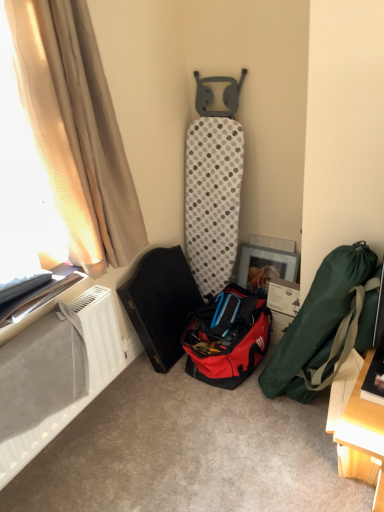
What do you see at coordinates (227, 341) in the screenshot? I see `red fabric bag at center, which is the second luggage and bags in right-to-left order` at bounding box center [227, 341].

Find the location of a particular element. green fabric bag at right, which is the 2th luggage and bags from left to right is located at coordinates (318, 321).

What do you see at coordinates (21, 188) in the screenshot? I see `translucent beige curtain at left` at bounding box center [21, 188].

Find the location of a particular element. This screenshot has height=512, width=384. red fabric bag at center, which is the second luggage and bags in right-to-left order is located at coordinates (227, 341).

Looking at this image, from the image's perspective, is white plastic radiator at lower left on green fabric bag at right, the 1th luggage and bags when ordered from right to left?

No, from the image's perspective, white plastic radiator at lower left is not on top of green fabric bag at right, the 1th luggage and bags when ordered from right to left.

Consider the image. Can you confirm if white plastic radiator at lower left is smaller than green fabric bag at right, which is the 2th luggage and bags from left to right?

Yes, white plastic radiator at lower left is smaller than green fabric bag at right, which is the 2th luggage and bags from left to right.

From a real-world perspective, which object rests below the other?

From a 3D spatial view, green fabric bag at right, the 1th luggage and bags when ordered from right to left, is below.

Is white plastic radiator at lower left surrounding green fabric bag at right, which is the 2th luggage and bags from left to right?

No, green fabric bag at right, which is the 2th luggage and bags from left to right, is located outside of white plastic radiator at lower left.

From a real-world perspective, is green fabric bag at right, which is the 2th luggage and bags from left to right, on top of translucent beige curtain at left?

No, from a real-world perspective, green fabric bag at right, which is the 2th luggage and bags from left to right, is not on top of translucent beige curtain at left.

In terms of height, does green fabric bag at right, the 1th luggage and bags when ordered from right to left, look taller or shorter compared to translucent beige curtain at left?

In the image, green fabric bag at right, the 1th luggage and bags when ordered from right to left, appears to be shorter than translucent beige curtain at left.

Can you see green fabric bag at right, which is the 2th luggage and bags from left to right, touching translucent beige curtain at left?

No, green fabric bag at right, which is the 2th luggage and bags from left to right, is not next to translucent beige curtain at left.

Who is more distant, beige fabric curtain at left or white plastic radiator at lower left?

white plastic radiator at lower left is further from the camera.

From the image's perspective, which one is positioned lower, beige fabric curtain at left or white plastic radiator at lower left?

white plastic radiator at lower left, from the image's perspective.

Based on the photo, how many degrees apart are the facing directions of beige fabric curtain at left and white plastic radiator at lower left?

1.37 degrees.

Is beige fabric curtain at left at the right side of white plastic radiator at lower left?

Yes.

Which is more to the right, red fabric bag at center, which is the second luggage and bags in right-to-left order, or green fabric bag at right, which is the 2th luggage and bags from left to right?

From the viewer's perspective, green fabric bag at right, which is the 2th luggage and bags from left to right, appears more on the right side.

From a real-world perspective, is red fabric bag at center, which is the second luggage and bags in right-to-left order, physically above green fabric bag at right, which is the 2th luggage and bags from left to right?

No, from a real-world perspective, red fabric bag at center, which is the second luggage and bags in right-to-left order, is not above green fabric bag at right, which is the 2th luggage and bags from left to right.

Can you tell me how much red fabric bag at center, which is the second luggage and bags in right-to-left order, and green fabric bag at right, the 1th luggage and bags when ordered from right to left, differ in facing direction?

They differ by 0.0369 degrees in their facing directions.

What are the coordinates of `luggage and bags on the right of the red fabric bag at center, the 1th luggage and bags in the left-to-right sequence` in the screenshot? It's located at (318, 321).

From a real-world perspective, is translucent beige curtain at left on white plastic radiator at lower left?

Indeed, from a real-world perspective, translucent beige curtain at left stands above white plastic radiator at lower left.

Would you say translucent beige curtain at left is inside or outside white plastic radiator at lower left?

translucent beige curtain at left is spatially situated outside white plastic radiator at lower left.

Considering the relative positions of translucent beige curtain at left and white plastic radiator at lower left in the image provided, is translucent beige curtain at left to the left or to the right of white plastic radiator at lower left?

In the image, translucent beige curtain at left appears on the left side of white plastic radiator at lower left.

The height and width of the screenshot is (512, 384). I want to click on window screen above the white plastic radiator at lower left (from a real-world perspective), so click(21, 188).

Is point (5, 163) closer or farther from the camera than point (248, 325)?

Point (5, 163) is closer to the camera than point (248, 325).

Is the surface of translucent beige curtain at left in direct contact with red fabric bag at center, the 1th luggage and bags in the left-to-right sequence?

No, translucent beige curtain at left is not touching red fabric bag at center, the 1th luggage and bags in the left-to-right sequence.

From the image's perspective, is translucent beige curtain at left under red fabric bag at center, which is the second luggage and bags in right-to-left order?

Actually, translucent beige curtain at left appears above red fabric bag at center, which is the second luggage and bags in right-to-left order, in the image.

Is translucent beige curtain at left facing towards red fabric bag at center, the 1th luggage and bags in the left-to-right sequence?

No, translucent beige curtain at left does not turn towards red fabric bag at center, the 1th luggage and bags in the left-to-right sequence.

Is white plastic radiator at lower left oriented towards beige fabric curtain at left?

No, white plastic radiator at lower left is not aimed at beige fabric curtain at left.

Is white plastic radiator at lower left situated inside beige fabric curtain at left or outside?

white plastic radiator at lower left cannot be found inside beige fabric curtain at left.

From a real-world perspective, is white plastic radiator at lower left physically above beige fabric curtain at left?

Incorrect, from a real-world perspective, white plastic radiator at lower left is lower than beige fabric curtain at left.

Which of these two, white plastic radiator at lower left or beige fabric curtain at left, stands taller?

With more height is beige fabric curtain at left.

There is a white plastic radiator at lower left. Where is `the 1st luggage and bags below it (from a real-world perspective)`? This screenshot has width=384, height=512. the 1st luggage and bags below it (from a real-world perspective) is located at coordinates (318, 321).

Identify the location of window screen on the left of the green fabric bag at right, which is the 2th luggage and bags from left to right. (21, 188).

Estimate the real-world distances between objects in this image. Which object is closer to beige fabric curtain at left, white plastic radiator at lower left or translucent beige curtain at left?

translucent beige curtain at left is positioned closer to the anchor beige fabric curtain at left.

Based on their spatial positions, is translucent beige curtain at left or green fabric bag at right, the 1th luggage and bags when ordered from right to left, further from beige fabric curtain at left?

Based on the image, green fabric bag at right, the 1th luggage and bags when ordered from right to left, appears to be further to beige fabric curtain at left.

Looking at the image, which one is located closer to beige fabric curtain at left, green fabric bag at right, which is the 2th luggage and bags from left to right, or white plastic radiator at lower left?

Based on the image, white plastic radiator at lower left appears to be nearer to beige fabric curtain at left.

Looking at the image, which one is located further to red fabric bag at center, the 1th luggage and bags in the left-to-right sequence, translucent beige curtain at left or beige fabric curtain at left?

translucent beige curtain at left is positioned further to the anchor red fabric bag at center, the 1th luggage and bags in the left-to-right sequence.

When comparing their distances from white plastic radiator at lower left, does green fabric bag at right, which is the 2th luggage and bags from left to right, or beige fabric curtain at left seem further?

Based on the image, green fabric bag at right, which is the 2th luggage and bags from left to right, appears to be further to white plastic radiator at lower left.

Looking at the image, which one is located further to green fabric bag at right, the 1th luggage and bags when ordered from right to left, beige fabric curtain at left or white plastic radiator at lower left?

beige fabric curtain at left lies further to green fabric bag at right, the 1th luggage and bags when ordered from right to left, than the other object.

Based on their spatial positions, is translucent beige curtain at left or beige fabric curtain at left closer to green fabric bag at right, which is the 2th luggage and bags from left to right?

Based on the image, beige fabric curtain at left appears to be nearer to green fabric bag at right, which is the 2th luggage and bags from left to right.

When comparing their distances from translucent beige curtain at left, does beige fabric curtain at left or red fabric bag at center, which is the second luggage and bags in right-to-left order, seem further?

red fabric bag at center, which is the second luggage and bags in right-to-left order, is further to translucent beige curtain at left.

Find the location of `window screen between beige fabric curtain at left and white plastic radiator at lower left in the up-down direction`. window screen between beige fabric curtain at left and white plastic radiator at lower left in the up-down direction is located at coordinates (21, 188).

Identify the location of curtain between translucent beige curtain at left and red fabric bag at center, which is the second luggage and bags in right-to-left order. (76, 130).

Where is `luggage and bags between beige fabric curtain at left and green fabric bag at right, the 1th luggage and bags when ordered from right to left`? This screenshot has height=512, width=384. luggage and bags between beige fabric curtain at left and green fabric bag at right, the 1th luggage and bags when ordered from right to left is located at coordinates (227, 341).

The width and height of the screenshot is (384, 512). I want to click on radiator between translucent beige curtain at left and green fabric bag at right, the 1th luggage and bags when ordered from right to left, so click(x=88, y=372).